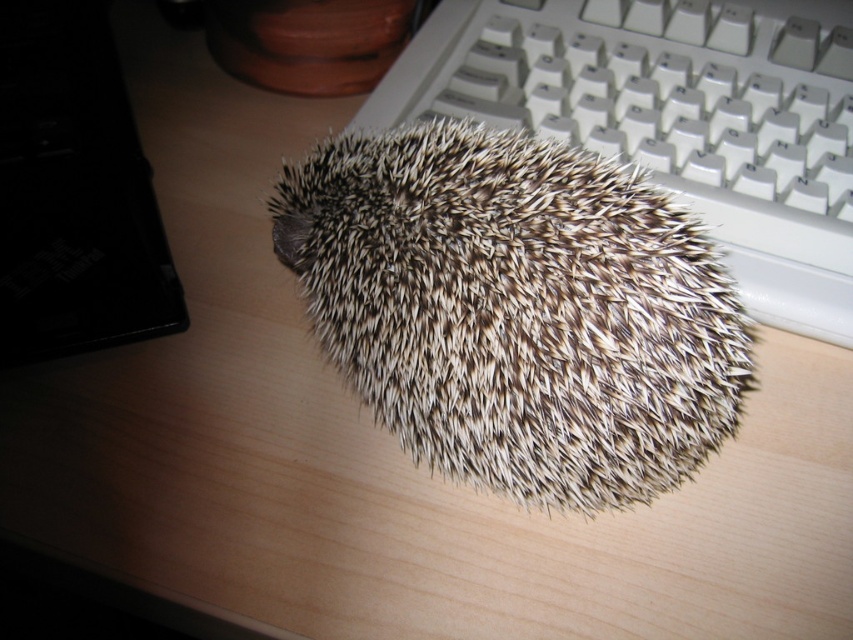
Question: Is brown spiny hedgehog at center positioned at the back of white plastic keyboard at upper right?

Choices:
 (A) no
 (B) yes

Answer: (A)

Question: Which point is farther to the camera?

Choices:
 (A) white plastic keyboard at upper right
 (B) brown spiny hedgehog at center

Answer: (A)

Question: Which of the following is the closest to the observer?

Choices:
 (A) (520, 358)
 (B) (415, 108)

Answer: (A)

Question: Does brown spiny hedgehog at center have a greater width compared to white plastic keyboard at upper right?

Choices:
 (A) yes
 (B) no

Answer: (B)

Question: Can you confirm if brown spiny hedgehog at center is thinner than white plastic keyboard at upper right?

Choices:
 (A) no
 (B) yes

Answer: (B)